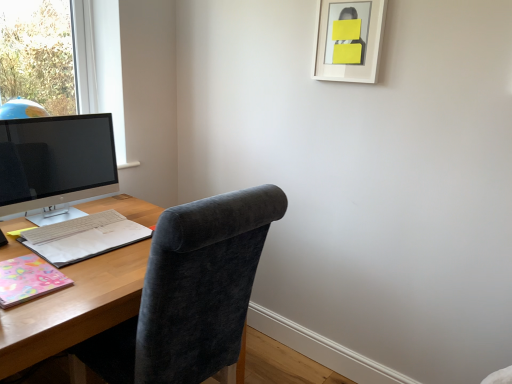
Question: Is satin black monitor at left aimed at multicolored paper notebook at left, acting as the second notebook starting from the front?

Choices:
 (A) yes
 (B) no

Answer: (A)

Question: Does satin black monitor at left have a lesser width compared to multicolored paper notebook at left, acting as the second notebook starting from the front?

Choices:
 (A) no
 (B) yes

Answer: (B)

Question: Considering the relative sizes of satin black monitor at left and multicolored paper notebook at left, acting as the second notebook starting from the front, in the image provided, is satin black monitor at left smaller than multicolored paper notebook at left, acting as the second notebook starting from the front,?

Choices:
 (A) yes
 (B) no

Answer: (B)

Question: Considering the relative positions of satin black monitor at left and multicolored paper notebook at left, acting as the first notebook starting from the back, in the image provided, is satin black monitor at left to the left of multicolored paper notebook at left, acting as the first notebook starting from the back, from the viewer's perspective?

Choices:
 (A) no
 (B) yes

Answer: (B)

Question: Is satin black monitor at left not inside multicolored paper notebook at left, acting as the second notebook starting from the front?

Choices:
 (A) no
 (B) yes

Answer: (B)

Question: Looking at their shapes, would you say satin black monitor at left is wider or thinner than white matte picture frame at upper right?

Choices:
 (A) wide
 (B) thin

Answer: (A)

Question: Relative to white matte picture frame at upper right, is satin black monitor at left in front or behind?

Choices:
 (A) behind
 (B) front

Answer: (B)

Question: Considering the relative positions of satin black monitor at left and white matte picture frame at upper right in the image provided, is satin black monitor at left to the left or to the right of white matte picture frame at upper right?

Choices:
 (A) left
 (B) right

Answer: (A)

Question: Considering the positions of satin black monitor at left and white matte picture frame at upper right in the image, is satin black monitor at left bigger or smaller than white matte picture frame at upper right?

Choices:
 (A) big
 (B) small

Answer: (A)

Question: Based on their sizes in the image, would you say pastel floral paper at lower left, which is the 2th notebook from back to front, is bigger or smaller than white matte keyboard at lower left?

Choices:
 (A) small
 (B) big

Answer: (A)

Question: Looking at their shapes, would you say pastel floral paper at lower left, the first notebook from the front, is wider or thinner than white matte keyboard at lower left?

Choices:
 (A) wide
 (B) thin

Answer: (A)

Question: Considering the positions of point (20, 294) and point (55, 225), is point (20, 294) closer or farther from the camera than point (55, 225)?

Choices:
 (A) farther
 (B) closer

Answer: (B)

Question: Visually, is pastel floral paper at lower left, which is the 2th notebook from back to front, positioned to the left or to the right of white matte keyboard at lower left?

Choices:
 (A) right
 (B) left

Answer: (B)

Question: From the image's perspective, relative to multicolored paper notebook at left, acting as the second notebook starting from the front, is pastel floral paper at lower left, which is the 2th notebook from back to front, above or below?

Choices:
 (A) below
 (B) above

Answer: (A)

Question: Is pastel floral paper at lower left, the first notebook from the front, wider or thinner than multicolored paper notebook at left, acting as the first notebook starting from the back?

Choices:
 (A) wide
 (B) thin

Answer: (B)